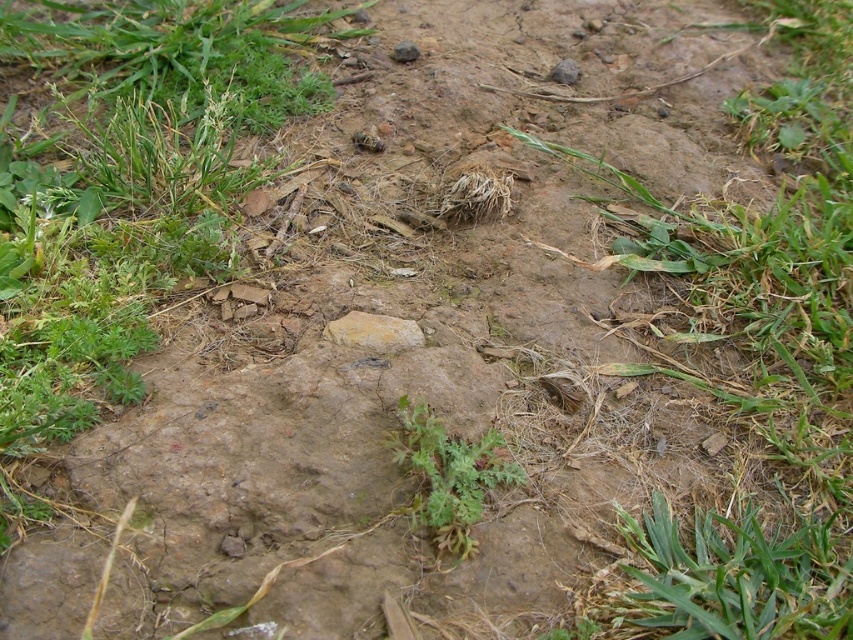
Who is positioned more to the right, green grass at center or green leafy grass at center?

Positioned to the right is green grass at center.

Is point (624, 243) positioned after point (204, 268)?

Yes, it is behind point (204, 268).

Where is `green grass at center`? This screenshot has height=640, width=853. green grass at center is located at coordinates (x=762, y=365).

Is green grass at center taller than yellowish rock at center?

Correct, green grass at center is much taller as yellowish rock at center.

Who is positioned more to the left, green grass at center or yellowish rock at center?

Positioned to the left is yellowish rock at center.

Identify the location of green grass at center. (762, 365).

Is green leafy grass at center to the right of yellowish rock at center from the viewer's perspective?

No, green leafy grass at center is not to the right of yellowish rock at center.

Where is `green leafy grass at center`? The image size is (853, 640). green leafy grass at center is located at coordinates (129, 188).

Is point (82, 401) less distant than point (343, 339)?

That is True.

I want to click on green leafy grass at center, so 129,188.